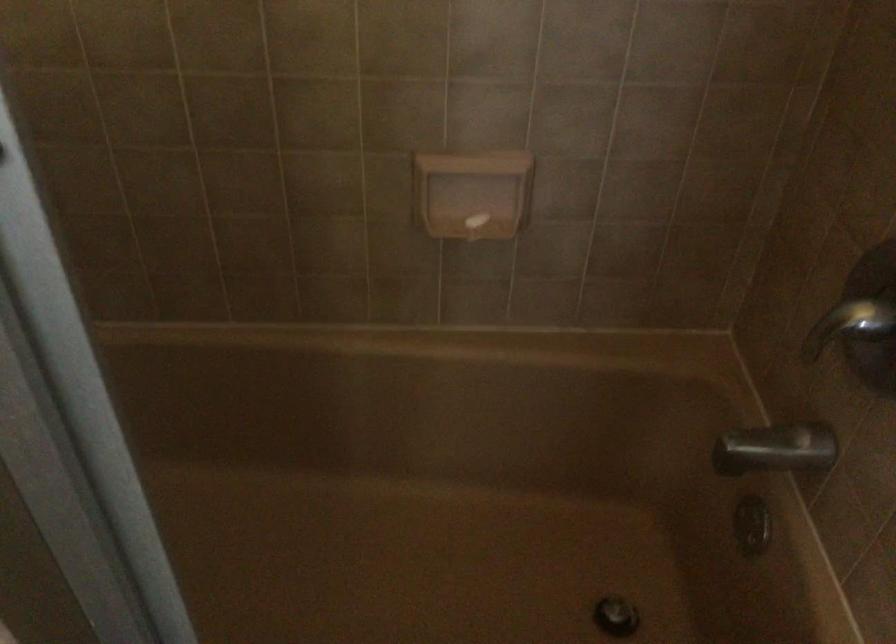
This screenshot has height=644, width=896. In order to click on silver faucet lever in this screenshot , I will do `click(776, 449)`.